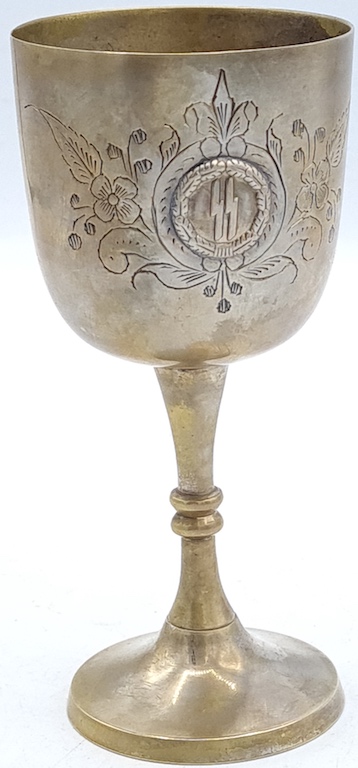
At what (x,y) coordinates should I click in order to perform the action: click on upper piece of the goblet stem. Please return your answer as a coordinate pair (x, y). The image size is (358, 768). Looking at the image, I should click on (188, 425).